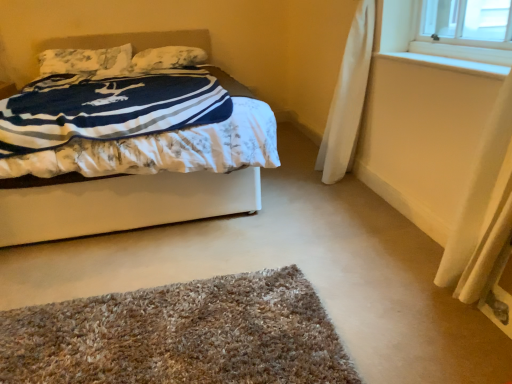
In order to click on vacant space behind brown shaggy rug at lower center in this screenshot , I will do `click(197, 246)`.